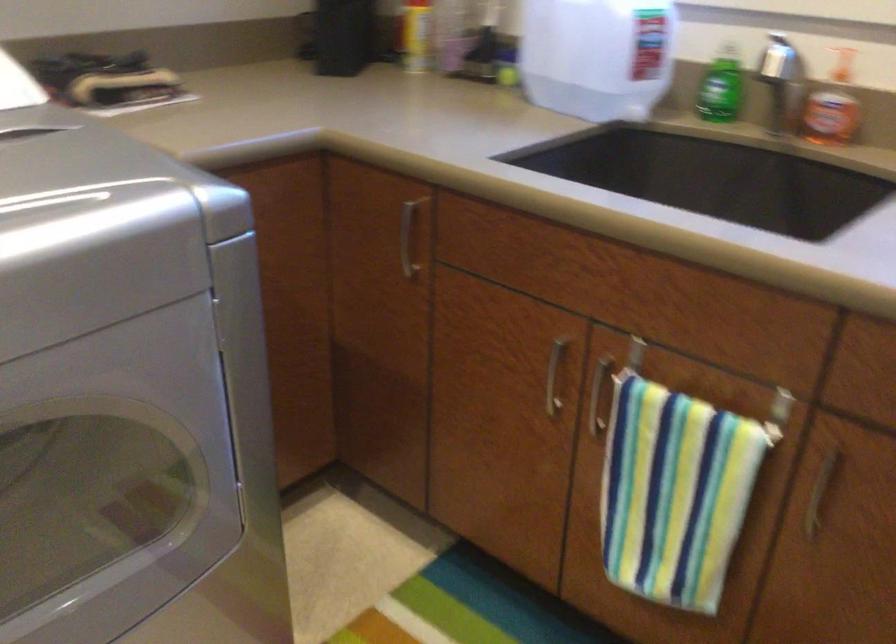
The height and width of the screenshot is (644, 896). Describe the element at coordinates (718, 105) in the screenshot. I see `the green dispenser pump` at that location.